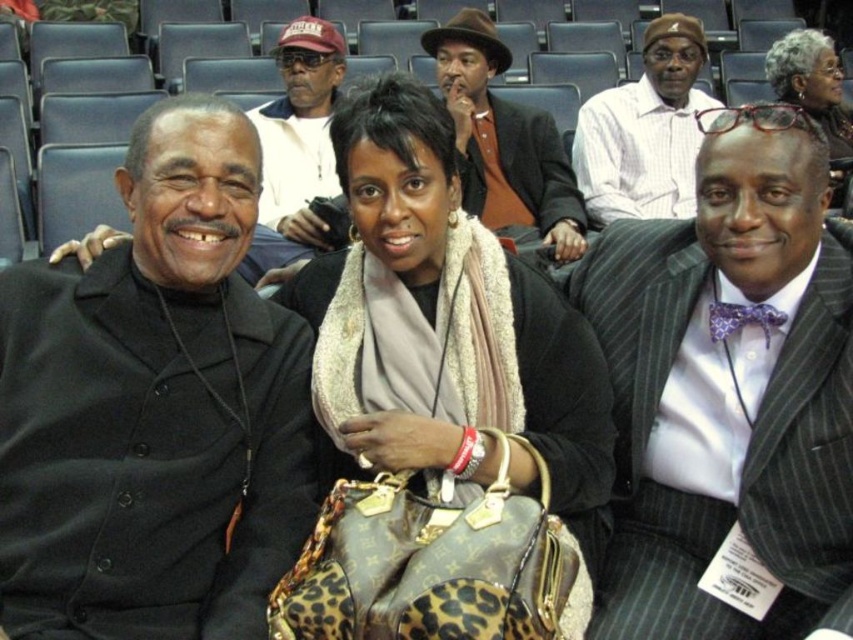
Question: Which point is closer to the camera?

Choices:
 (A) leopard print handbag at center
 (B) pinstriped suit at center

Answer: (A)

Question: Is black matte suit at left further to the viewer compared to matte black jacket at center?

Choices:
 (A) yes
 (B) no

Answer: (B)

Question: Which point is closer to the camera taking this photo?

Choices:
 (A) (456, 481)
 (B) (843, 147)
 (C) (444, 90)

Answer: (A)

Question: Which object appears farthest from the camera in this image?

Choices:
 (A) matte black jacket at center
 (B) pinstriped suit at center
 (C) brown felt hat at center
 (D) leopard print handbag at center

Answer: (C)

Question: Is pinstriped suit at center bigger than brown felt hat at center?

Choices:
 (A) no
 (B) yes

Answer: (A)

Question: Where is brown felt hat at center located in relation to white striped shirt at upper center in the image?

Choices:
 (A) above
 (B) below

Answer: (B)